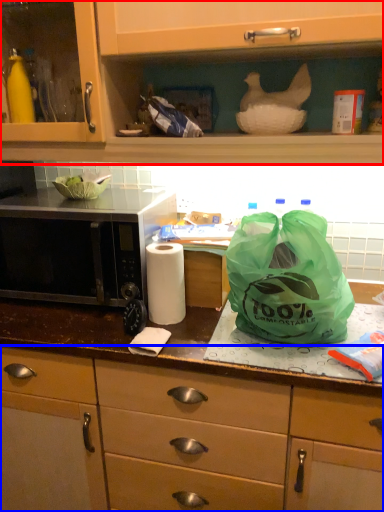
Question: Which of the following is the closest to the observer, cabinetry (highlighted by a red box) or cabinetry (highlighted by a blue box)?

Choices:
 (A) cabinetry
 (B) cabinetry

Answer: (A)